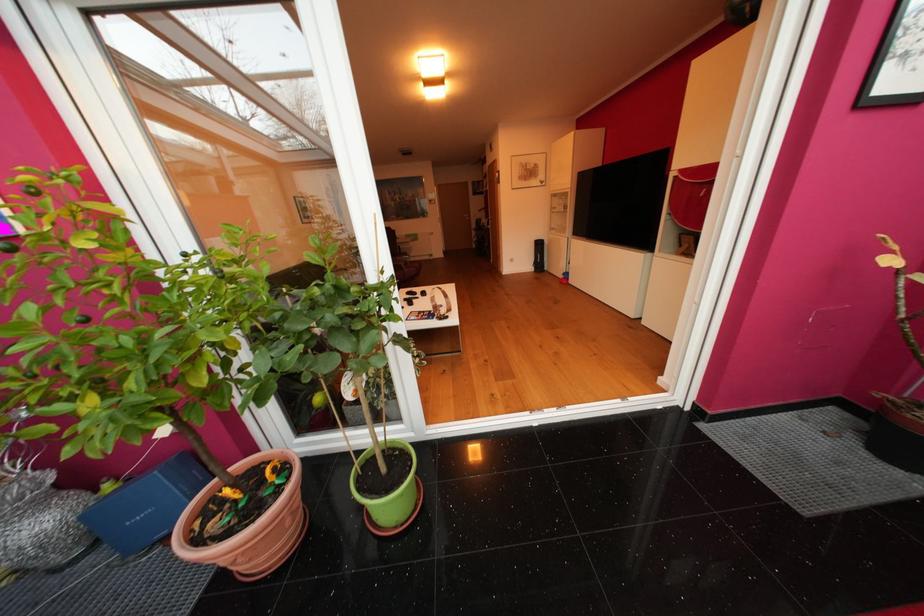
Which object does [539,256] point to?

This point indicates the black speaker.